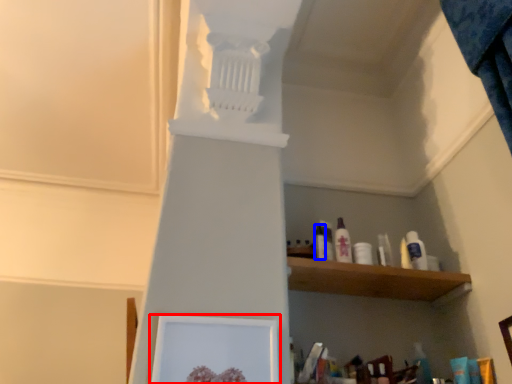
Question: Which object appears farthest to the camera in this image, picture frame (highlighted by a red box) or toiletry (highlighted by a blue box)?

Choices:
 (A) picture frame
 (B) toiletry

Answer: (B)